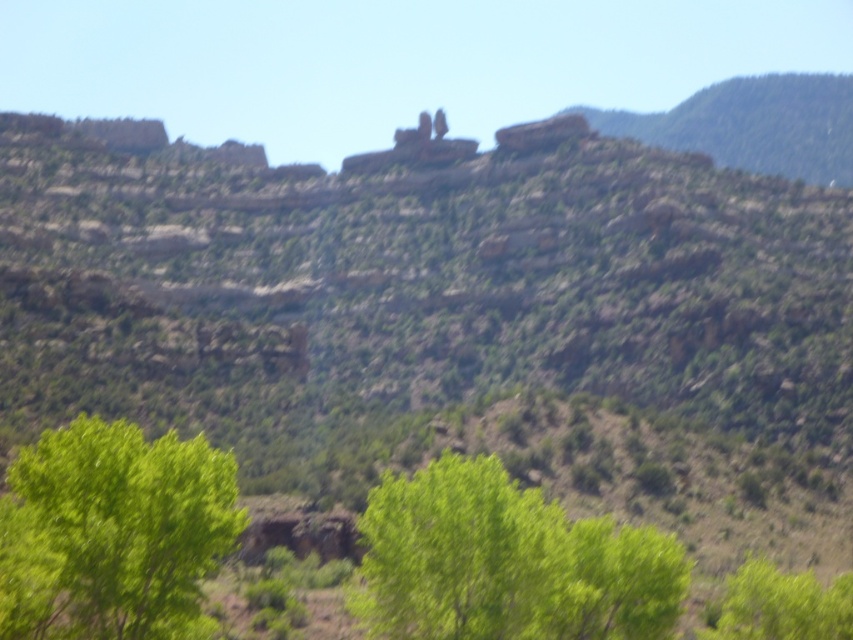
You are a hiker trying to navigate through the mountainous area. You see the green leafy tree at center and the green leafy tree at lower left. Which tree is closer to you?

The green leafy tree at center is closer to you because the green leafy tree at lower left is behind it.